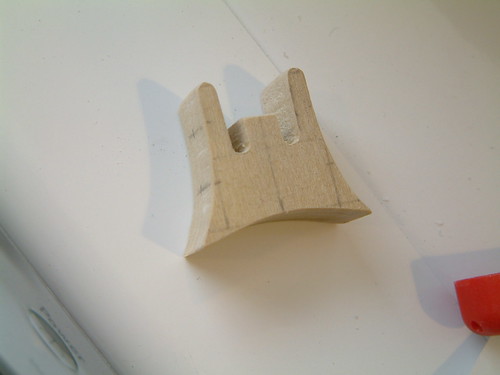
In order to click on handle in this screenshot , I will do `click(52, 343)`.